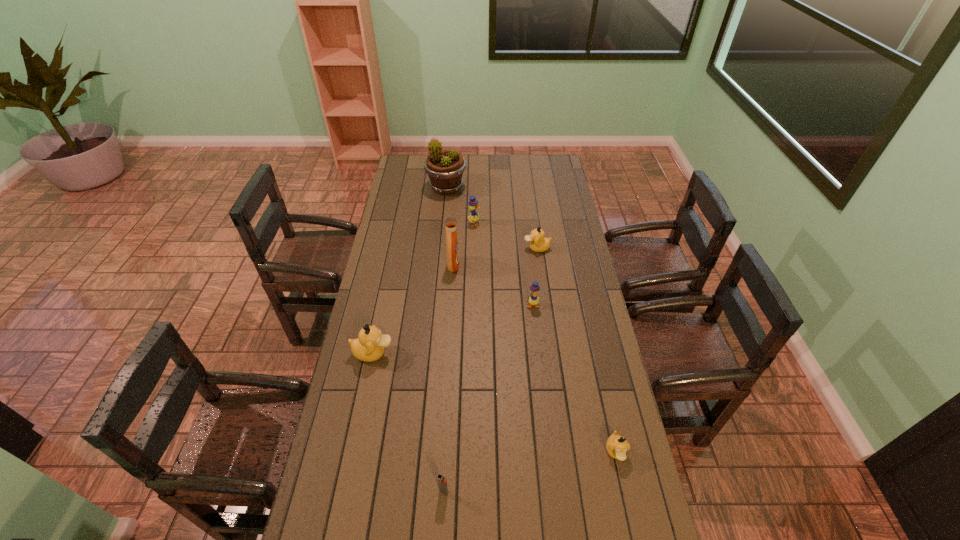
The width and height of the screenshot is (960, 540). Find the location of `vacant space situated on the face of the second tan duckling from right to left`. vacant space situated on the face of the second tan duckling from right to left is located at coordinates (459, 248).

In order to click on free location located 0.140m on the face of the second tan duckling from right to left in this screenshot , I will do `click(492, 248)`.

At what (x,y) coordinates should I click in order to perform the action: click on vacant area situated on the face of the smaller yellow duckling, where the monocle is placed. Please return your answer as a coordinate pair (x, y). This screenshot has width=960, height=540. Looking at the image, I should click on (540, 375).

Identify the location of free space located 0.160m on the right of the nearest object. (505, 491).

Identify the location of free space located on the face of the smallest tan duckling. The width and height of the screenshot is (960, 540). (625, 496).

This screenshot has width=960, height=540. Identify the location of object that is at the far edge. (445, 168).

Identify the location of object that is positioned at the left edge. (369, 346).

This screenshot has height=540, width=960. Identify the location of vacant space at the far edge. (470, 162).

The width and height of the screenshot is (960, 540). I want to click on vacant region at the left edge of the desktop, so click(x=417, y=215).

The image size is (960, 540). Find the location of `vacant space at the right edge of the desktop`. vacant space at the right edge of the desktop is located at coordinates (579, 397).